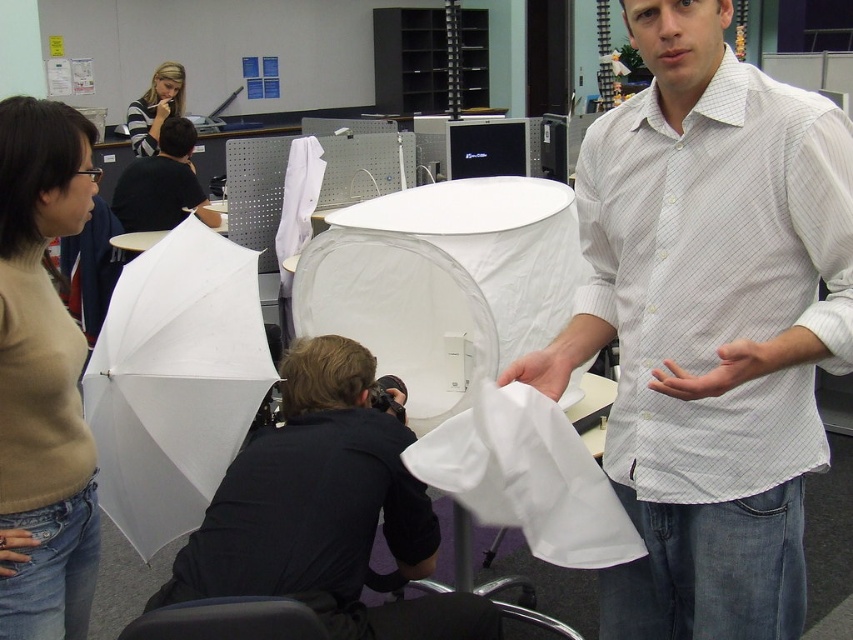
You are a photographer setting up a photoshoot. You notice two garments in the scene, the white matte shirt at center and the beige sweater at center. Which one is covering the other?

The white matte shirt at center is positioned over the beige sweater at center, so it is covering the sweater.

In the scene described, where is the white matte shirt at center located in terms of its 2D coordinates?

The white matte shirt at center is located at the 2D coordinates point [709,324].

You are a photographer setting up for a photoshoot. You need to position a reflector to the left of the white matte shirt at center and to the right of the matte black shirt at upper left. Is this possible based on their current positions?

The white matte shirt at center is already positioned to the right of the matte black shirt at upper left. Therefore, placing the reflector to the left of the white matte shirt at center and to the right of the matte black shirt at upper left is possible as they are arranged in that order from left to right.